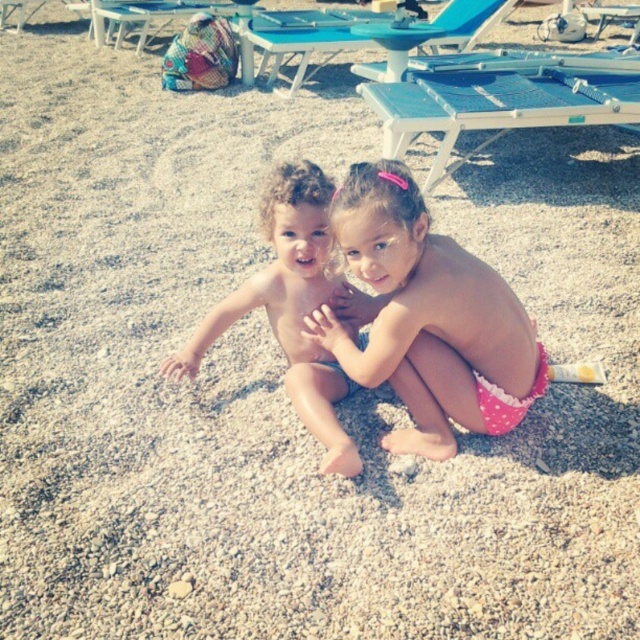
You are a lifeguard standing at the pink polka dot swimsuit at center. You need to retrieve the multicolored woven bag at upper left to get your keys. Considering the beach terrain, can you walk directly to the bag without any obstacles?

The distance between the pink polka dot swimsuit at center and the multicolored woven bag at upper left is 8.06 meters. Since the beach terrain is pebbled and there are blue sun loungers in the background, you may encounter obstacles like the sun loungers or the bag being elevated, so you might need to navigate around them.

You are a photographer taking a picture of the two children at the beach. You notice the pink polka dot swimsuit at center and the smooth skin children at center. Which object is shorter in height?

The pink polka dot swimsuit at center is not as tall as the smooth skin children at center, so the pink polka dot swimsuit at center is shorter in height.

You are a photographer trying to capture a candid shot of the smooth skin children at center and the multicolored woven bag at upper left. Since you want to ensure both are in focus, which object should you adjust your camera focus on first considering their sizes?

The smooth skin children at center has a smaller size compared to the multicolored woven bag at upper left. To ensure both are in focus, you should focus on the smaller object first, which is the smooth skin children at center, as it requires more precise focus due to its smaller size.